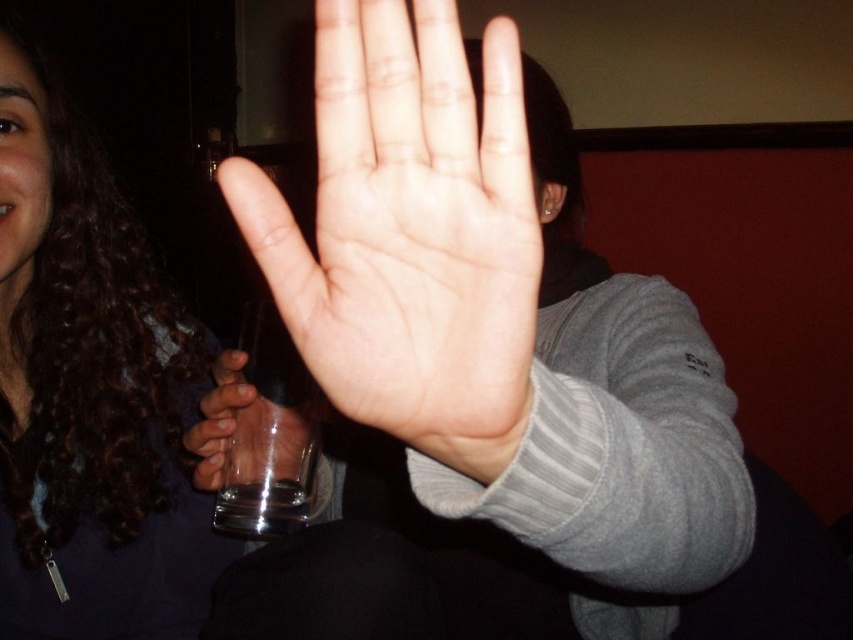
You are a photographer adjusting the focus on your camera. You want to capture a clear image of both the pale skin palm at center and the transparent glass at center. Which object should you focus on first to ensure both are in focus?

You should focus on the pale skin palm at center first because it is closer to the viewer than the transparent glass at center. By focusing on the closer object, the glass will also be in focus due to the depth of field extending beyond it.

You are a photographer adjusting the focus on your camera. You need to ensure that both the smooth skin hand at center and the dark curly hair at upper left are in focus. However, the depth of field is limited. Which object should you focus on to ensure at least one is clear?

You should focus on the smooth skin hand at center because it is closer to the camera than the dark curly hair at upper left. Since it is in front, focusing on it increases the chance of it being sharp while the background may blur.